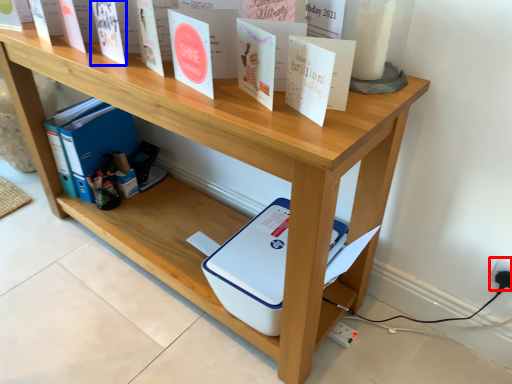
Question: Which of the following is the closest to the observer, electric outlet (highlighted by a red box) or paperback book (highlighted by a blue box)?

Choices:
 (A) electric outlet
 (B) paperback book

Answer: (B)